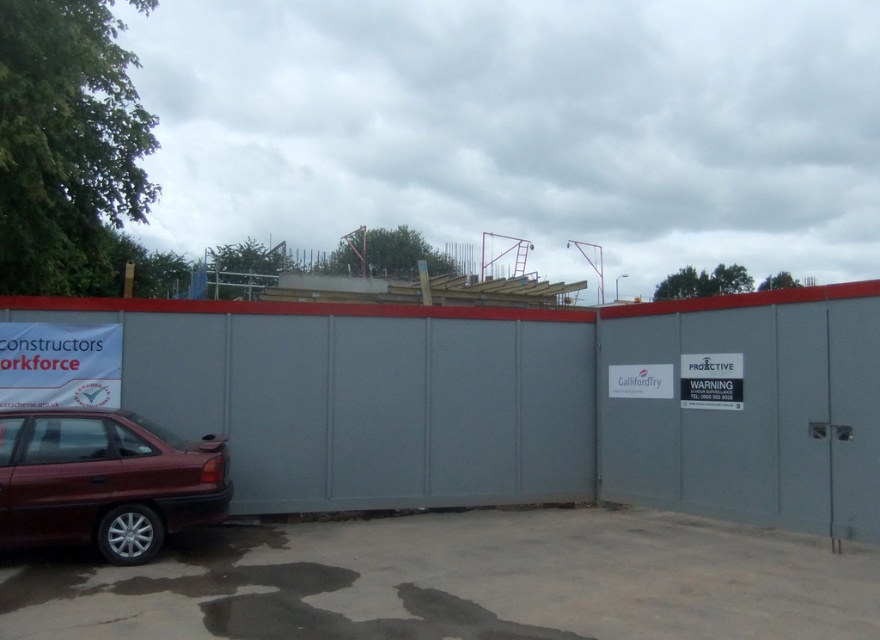
You are a pedestrian walking along the sidewalk and see the gray matte fence at center and the white paper sign at left. Which object is closer to you?

The gray matte fence at center is closer to you because it is in front of the white paper sign at left.

You are a delivery driver approaching the construction site and see the gray matte fence at center and the maroon metallic car at lower left. Which object is taller?

The gray matte fence at center is taller than the maroon metallic car at lower left according to the description.